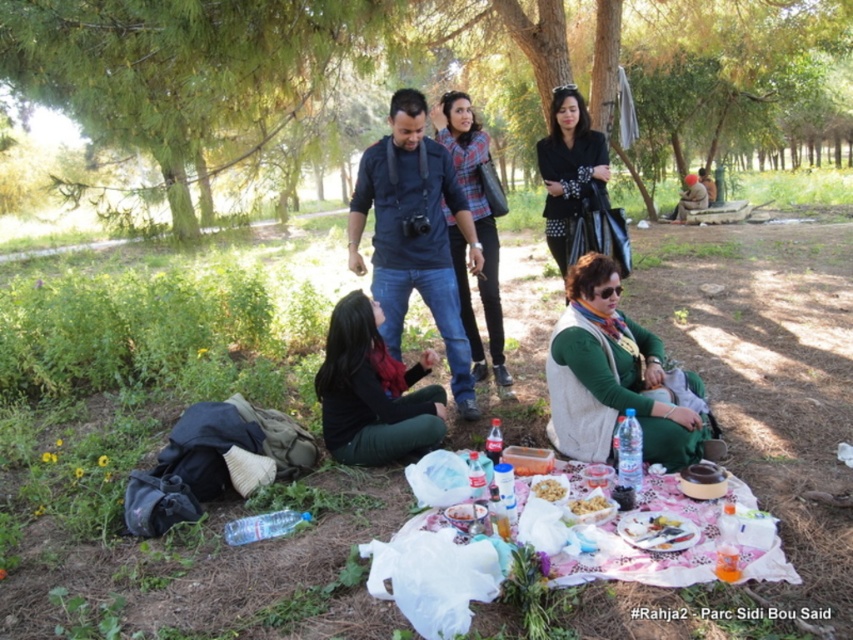
Question: Which object appears farthest from the camera in this image?

Choices:
 (A) plaid fabric shirt at center
 (B) white paper plate at center
 (C) green matte vest at center
 (D) matte black jacket at center

Answer: (A)

Question: Does matte black jacket at center have a smaller size compared to brown leather jacket at upper right?

Choices:
 (A) no
 (B) yes

Answer: (B)

Question: Is green matte vest at center positioned in front of white crumbly bread at center?

Choices:
 (A) yes
 (B) no

Answer: (B)

Question: Is brown leather jacket at upper right above white crumbly bread at center?

Choices:
 (A) yes
 (B) no

Answer: (A)

Question: Which object is closer to the camera taking this photo?

Choices:
 (A) green matte vest at center
 (B) brown leather jacket at upper right

Answer: (A)

Question: Among these points, which one is farthest from the camera?

Choices:
 (A) (634, 401)
 (B) (486, 312)
 (C) (587, 497)
 (D) (695, 205)

Answer: (D)